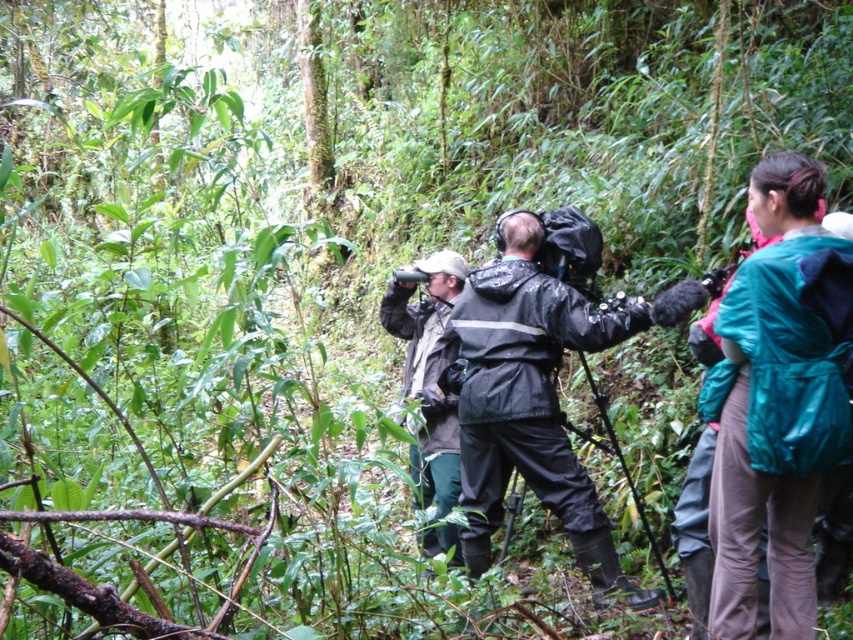
In the scene shown: You are standing at the point labeled as point (759, 161) in the forest. A hiker wants to know how far they are from you. What would you tell them?

The distance between point (759, 161) and the viewer is 6.39 meters, so the hiker is 6.39 meters away from you.

You are a hiker trying to locate two people in the forest. You see the teal matte jacket at right and the waterproof black jacket at center. Which person is higher up in the terrain?

The teal matte jacket at right is located above the waterproof black jacket at center, so the person wearing the teal matte jacket at right is higher up in the terrain.